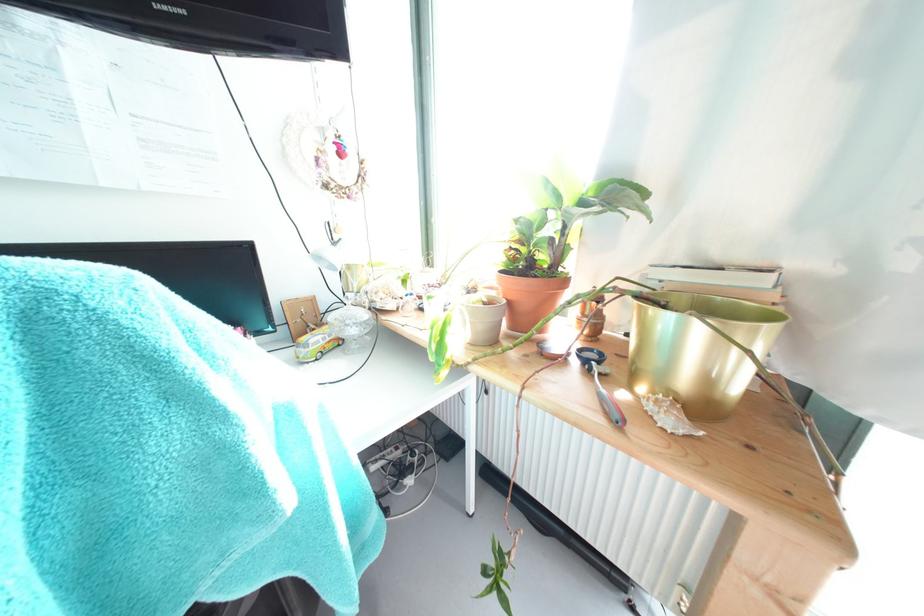
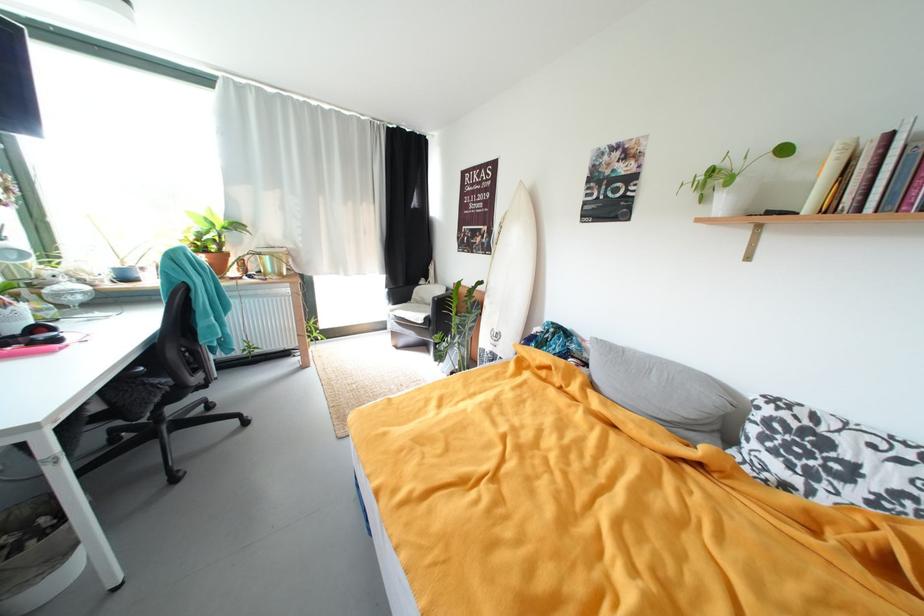
The point at (x=566, y=199) is marked in the first image. Where is the corresponding point in the second image?

(221, 225)